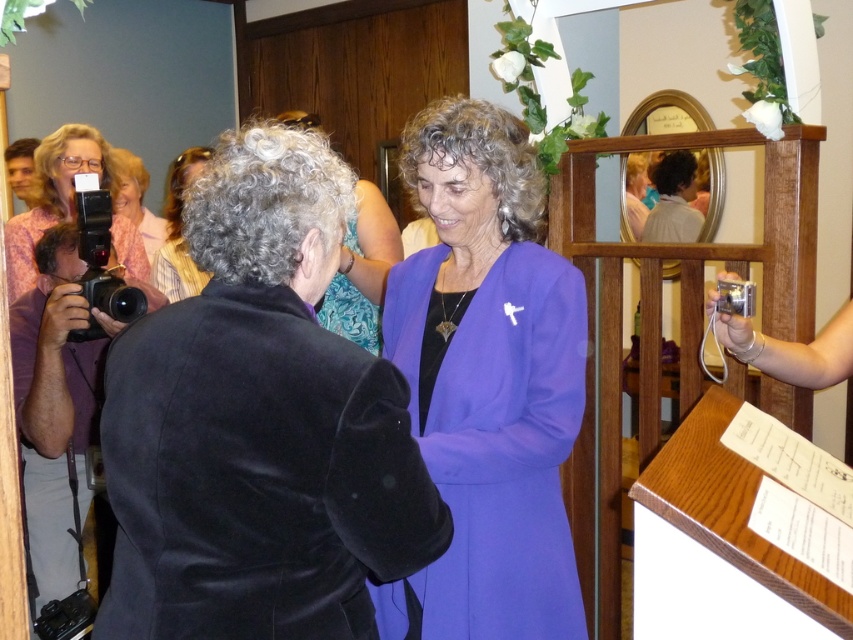
Question: Can you confirm if purple fabric dress at center is bigger than matte black camera at left?

Choices:
 (A) yes
 (B) no

Answer: (A)

Question: Which of the following is the farthest from the observer?

Choices:
 (A) purple fabric dress at center
 (B) matte purple dress at center

Answer: (B)

Question: Which point is closer to the camera?

Choices:
 (A) (202, 276)
 (B) (120, 154)

Answer: (A)

Question: Does purple fabric dress at center have a lesser width compared to matte black camera at left?

Choices:
 (A) yes
 (B) no

Answer: (A)

Question: Which point is farther to the camera?

Choices:
 (A) matte pink blouse at upper left
 (B) purple fabric dress at center

Answer: (A)

Question: Does purple fabric dress at center lie behind matte black camera at left?

Choices:
 (A) no
 (B) yes

Answer: (A)